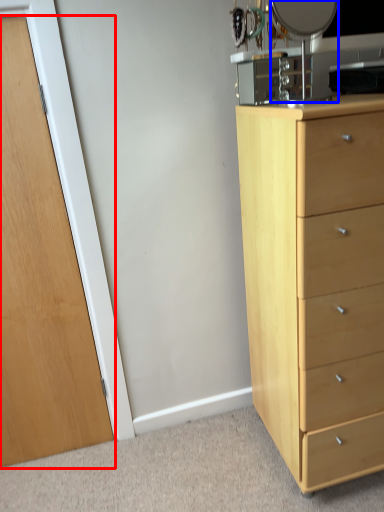
Question: Which point is closer to the camera, door (highlighted by a red box) or mirror (highlighted by a blue box)?

Choices:
 (A) door
 (B) mirror

Answer: (B)